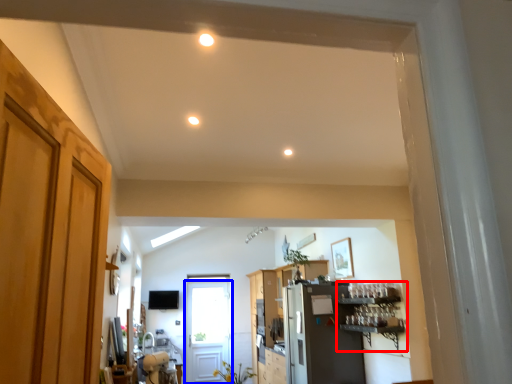
Question: Which object appears farthest to the camera in this image, shelf (highlighted by a red box) or door (highlighted by a blue box)?

Choices:
 (A) shelf
 (B) door

Answer: (B)